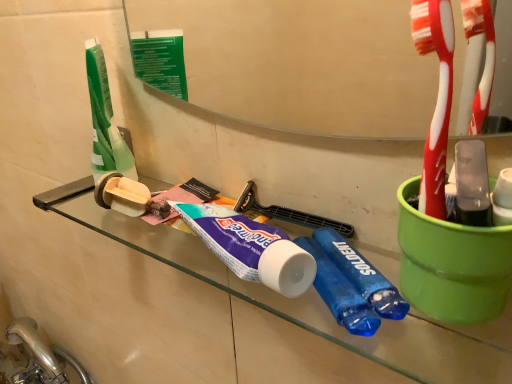
Question: Based on their positions, is beige cardboard toilet paper at left located to the left or right of satin nickel faucet at lower left?

Choices:
 (A) right
 (B) left

Answer: (A)

Question: From their relative heights in the image, would you say beige cardboard toilet paper at left is taller or shorter than satin nickel faucet at lower left?

Choices:
 (A) short
 (B) tall

Answer: (A)

Question: Which is nearer to the beige cardboard toilet paper at left?

Choices:
 (A) satin nickel faucet at lower left
 (B) purple matte toothpaste at center
 (C) transparent glass shelf at center

Answer: (B)

Question: Which of these objects is positioned closest to the beige cardboard toilet paper at left?

Choices:
 (A) satin nickel faucet at lower left
 (B) purple matte toothpaste at center
 (C) transparent glass shelf at center

Answer: (B)